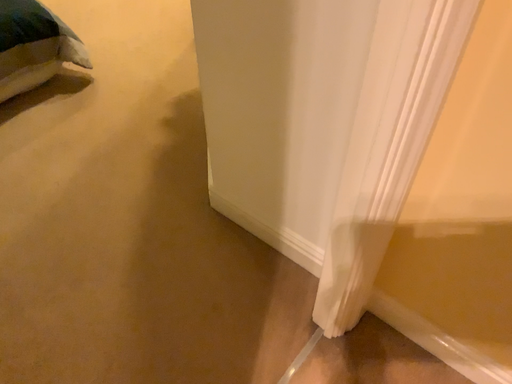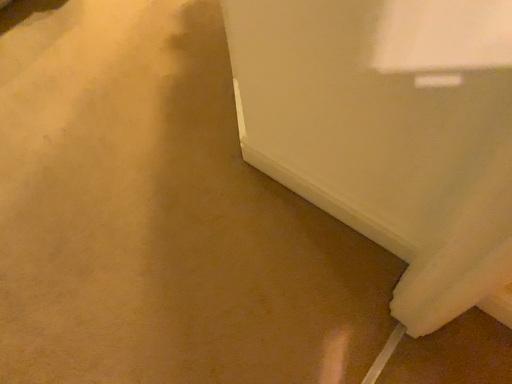
Question: How did the camera likely rotate when shooting the video?

Choices:
 (A) rotated downward
 (B) rotated upward

Answer: (A)